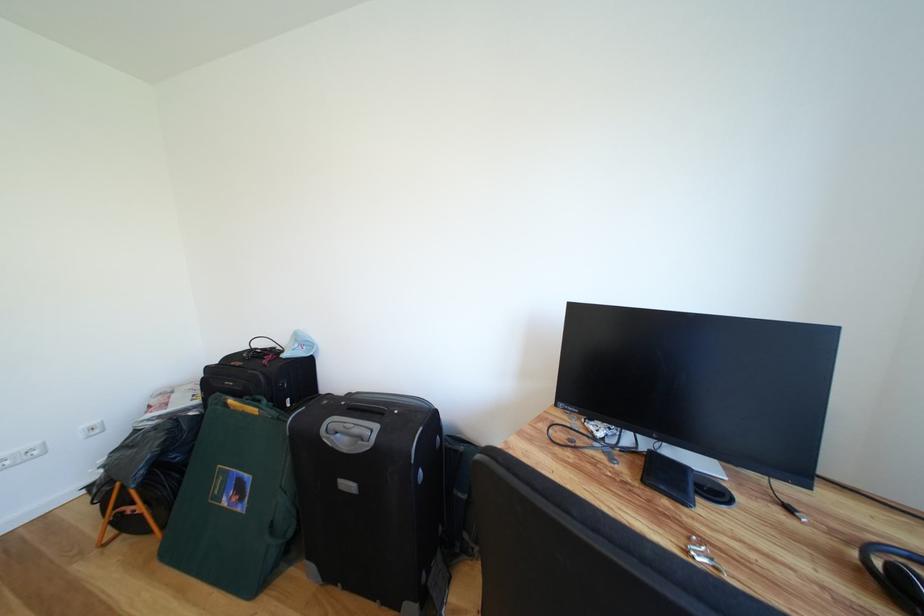
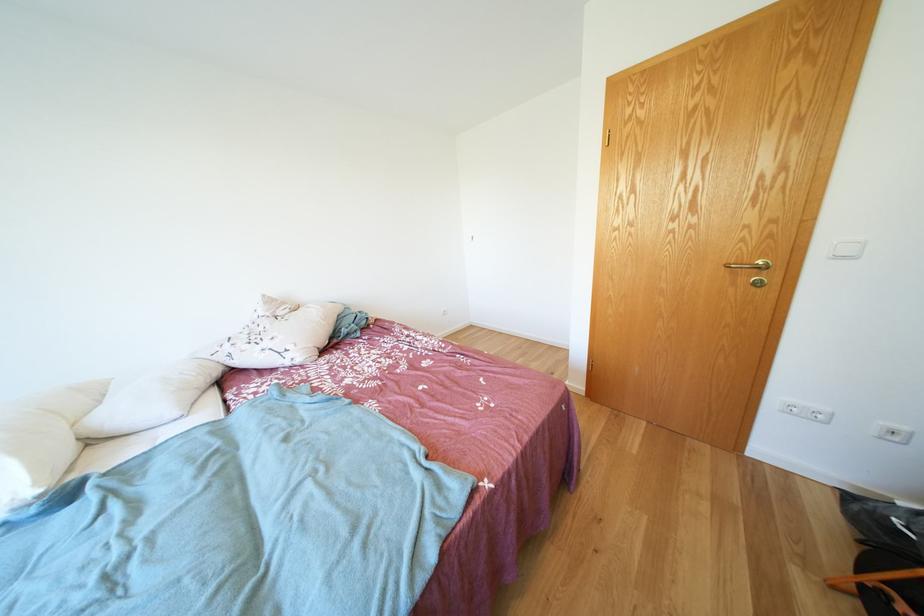
Based on the continuous images, in which direction is the camera rotating?

The camera's rotation is toward left-down.